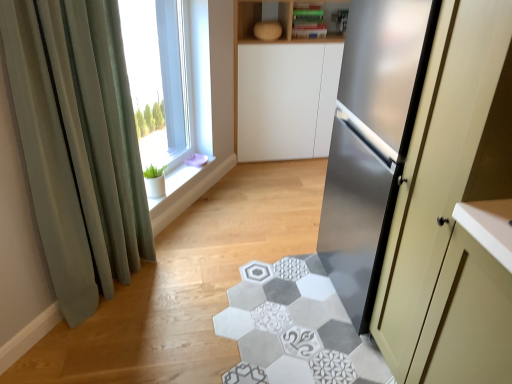
Question: Is green fabric curtain at left in front of or behind white ceramic window sill at upper left in the image?

Choices:
 (A) behind
 (B) front

Answer: (B)

Question: In terms of width, does green fabric curtain at left look wider or thinner when compared to white ceramic window sill at upper left?

Choices:
 (A) wide
 (B) thin

Answer: (B)

Question: Which object is the farthest from the green fabric curtain at left?

Choices:
 (A) clear glass window at upper left
 (B) white ceramic window sill at upper left
 (C) satin silver refrigerator at right

Answer: (C)

Question: Estimate the real-world distances between objects in this image. Which object is closer to the clear glass window at upper left?

Choices:
 (A) white ceramic window sill at upper left
 (B) satin silver refrigerator at right
 (C) green fabric curtain at left

Answer: (A)